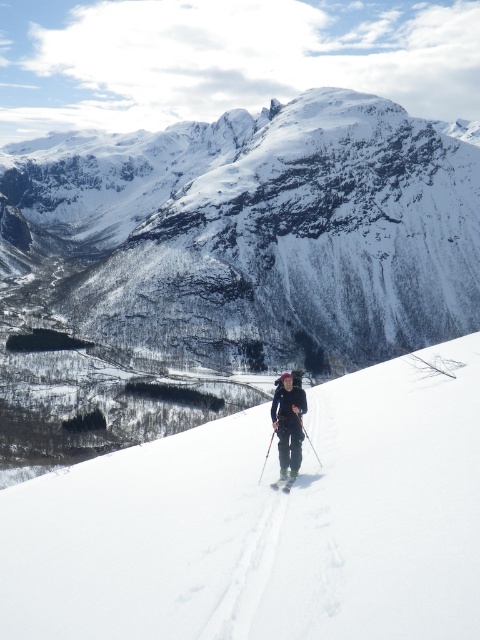
You are a drone operator trying to capture the white snow covered mountain at upper center. The drone is currently at point (250,230). Is the drone positioned correctly to capture the mountain?

The white snow covered mountain at upper center is located at point (250,230), so the drone is positioned correctly to capture the mountain.